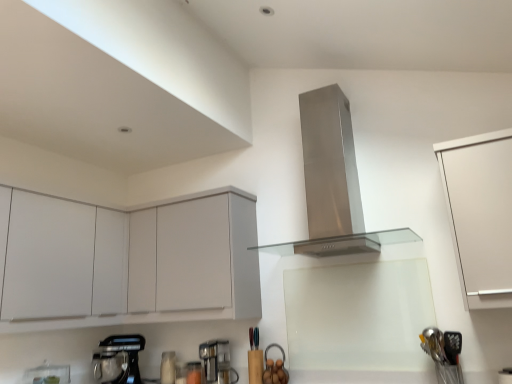
Question: Should I look upward or downward to see stainless steel range hood at center?

Choices:
 (A) up
 (B) down

Answer: (A)

Question: From the image's perspective, is white matte cabinet at left, which is the 3th cabinetry in right-to-left order, below metallic silver mixer at lower left?

Choices:
 (A) yes
 (B) no

Answer: (B)

Question: Considering the relative sizes of white matte cabinet at left, marked as the first cabinetry in a left-to-right arrangement, and metallic silver mixer at lower left in the image provided, is white matte cabinet at left, marked as the first cabinetry in a left-to-right arrangement, wider than metallic silver mixer at lower left?

Choices:
 (A) no
 (B) yes

Answer: (B)

Question: Is white matte cabinet at left, marked as the first cabinetry in a left-to-right arrangement, to the left of metallic silver mixer at lower left from the viewer's perspective?

Choices:
 (A) yes
 (B) no

Answer: (A)

Question: Does white matte cabinet at left, marked as the first cabinetry in a left-to-right arrangement, have a lesser height compared to metallic silver mixer at lower left?

Choices:
 (A) yes
 (B) no

Answer: (B)

Question: Is metallic silver mixer at lower left a part of white matte cabinet at left, marked as the first cabinetry in a left-to-right arrangement?

Choices:
 (A) yes
 (B) no

Answer: (B)

Question: Is the position of white matte cabinet at left, marked as the first cabinetry in a left-to-right arrangement, less distant than that of metallic silver mixer at lower left?

Choices:
 (A) no
 (B) yes

Answer: (B)

Question: Is metallic gray coffee machine at lower center bigger than metallic silver mixer at lower left?

Choices:
 (A) yes
 (B) no

Answer: (B)

Question: Is metallic gray coffee machine at lower center at the left side of metallic silver mixer at lower left?

Choices:
 (A) no
 (B) yes

Answer: (A)

Question: Considering the relative sizes of metallic gray coffee machine at lower center and metallic silver mixer at lower left in the image provided, is metallic gray coffee machine at lower center thinner than metallic silver mixer at lower left?

Choices:
 (A) yes
 (B) no

Answer: (A)

Question: Is metallic gray coffee machine at lower center far away from metallic silver mixer at lower left?

Choices:
 (A) no
 (B) yes

Answer: (A)

Question: From a real-world perspective, is metallic gray coffee machine at lower center positioned under metallic silver mixer at lower left based on gravity?

Choices:
 (A) yes
 (B) no

Answer: (A)

Question: Is the position of metallic gray coffee machine at lower center more distant than that of metallic silver mixer at lower left?

Choices:
 (A) yes
 (B) no

Answer: (B)

Question: Is white matte cabinet at upper left, acting as the 2th cabinetry starting from the right, completely or partially outside of stainless steel range hood at center?

Choices:
 (A) no
 (B) yes

Answer: (B)